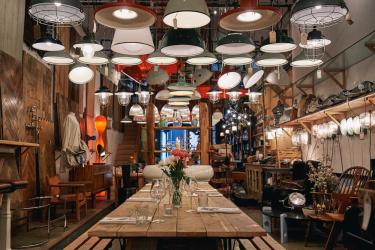
Where is `corners of table`? This screenshot has height=250, width=375. corners of table is located at coordinates (265, 231), (91, 232).